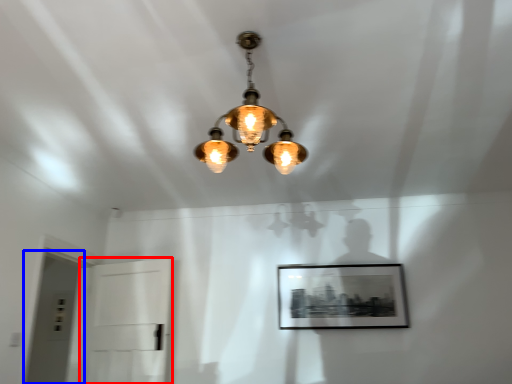
Question: Which of the following is the closest to the observer, glass door (highlighted by a red box) or glass door (highlighted by a blue box)?

Choices:
 (A) glass door
 (B) glass door

Answer: (B)